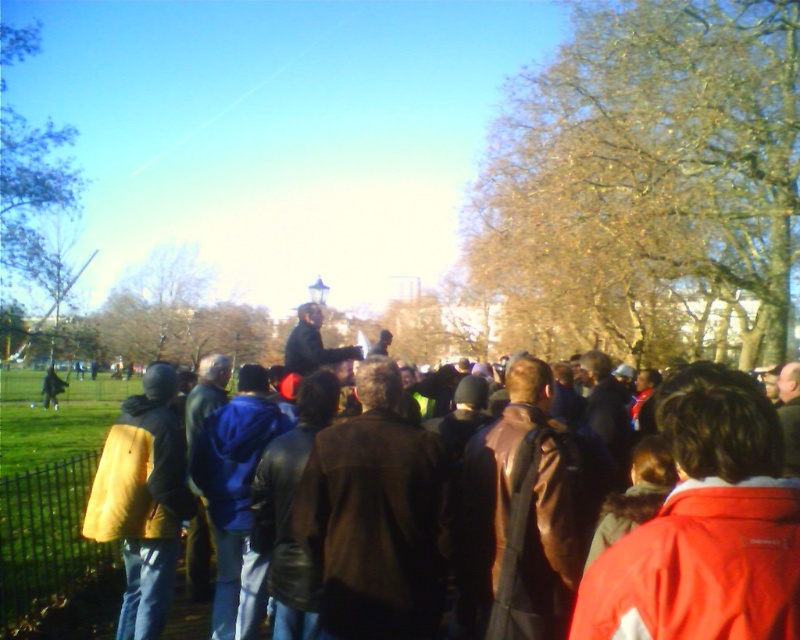
Question: Is red jacket at center to the left of brown leather jacket at center from the viewer's perspective?

Choices:
 (A) yes
 (B) no

Answer: (B)

Question: Which point is closer to the camera?

Choices:
 (A) yellow leather jacket at left
 (B) brown leather jacket at center
 (C) brown leafy tree at upper right

Answer: (B)

Question: Can you confirm if red jacket at center is smaller than yellow leather jacket at left?

Choices:
 (A) yes
 (B) no

Answer: (B)

Question: Can you confirm if brown leafy tree at upper right is positioned below red jacket at center?

Choices:
 (A) yes
 (B) no

Answer: (B)

Question: Which point appears closest to the camera in this image?

Choices:
 (A) (788, 600)
 (B) (632, 541)
 (C) (792, 99)
 (D) (28, 266)

Answer: (A)

Question: Which point is closer to the camera taking this photo?

Choices:
 (A) (720, 262)
 (B) (8, 170)

Answer: (A)